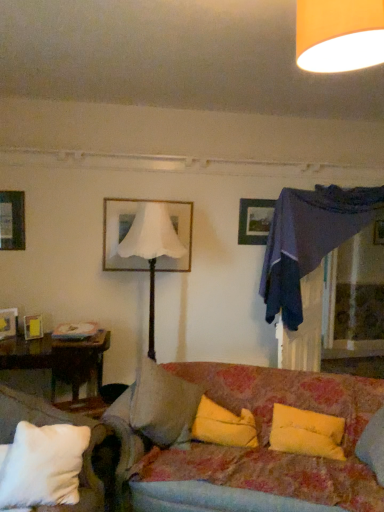
Where is `vacant area on top of white matte picture frame at upper center, marked as the first picture frame in a right-to-left arrangement (from a real-world perspective)`? Image resolution: width=384 pixels, height=512 pixels. vacant area on top of white matte picture frame at upper center, marked as the first picture frame in a right-to-left arrangement (from a real-world perspective) is located at coordinates (155, 194).